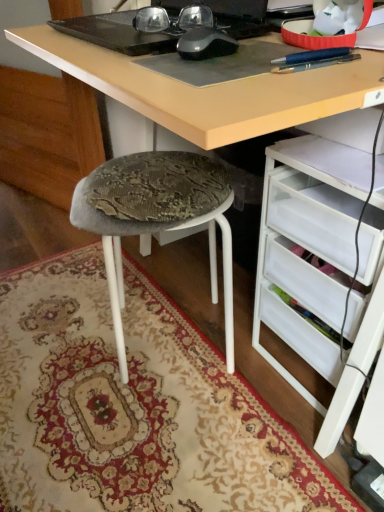
Question: Can you confirm if white plastic drawers at lower right is bigger than carpeted rug at lower left?

Choices:
 (A) no
 (B) yes

Answer: (B)

Question: From a real-world perspective, is white plastic drawers at lower right positioned over carpeted rug at lower left based on gravity?

Choices:
 (A) yes
 (B) no

Answer: (A)

Question: Is white plastic drawers at lower right beside carpeted rug at lower left?

Choices:
 (A) yes
 (B) no

Answer: (B)

Question: Is white plastic drawers at lower right closer to the viewer compared to carpeted rug at lower left?

Choices:
 (A) no
 (B) yes

Answer: (A)

Question: Does white plastic drawers at lower right have a lesser height compared to carpeted rug at lower left?

Choices:
 (A) yes
 (B) no

Answer: (B)

Question: From a real-world perspective, is white plastic drawers at lower right located beneath carpeted rug at lower left?

Choices:
 (A) yes
 (B) no

Answer: (B)

Question: Considering the relative positions of white plastic drawers at lower right and textured fabric stool at lower left in the image provided, is white plastic drawers at lower right to the right of textured fabric stool at lower left from the viewer's perspective?

Choices:
 (A) no
 (B) yes

Answer: (B)

Question: Is white plastic drawers at lower right positioned behind textured fabric stool at lower left?

Choices:
 (A) no
 (B) yes

Answer: (A)

Question: Can we say white plastic drawers at lower right lies outside textured fabric stool at lower left?

Choices:
 (A) yes
 (B) no

Answer: (A)

Question: Considering the relative sizes of white plastic drawers at lower right and textured fabric stool at lower left in the image provided, is white plastic drawers at lower right wider than textured fabric stool at lower left?

Choices:
 (A) no
 (B) yes

Answer: (A)

Question: Does white plastic drawers at lower right touch textured fabric stool at lower left?

Choices:
 (A) no
 (B) yes

Answer: (A)

Question: Considering the relative sizes of white plastic drawers at lower right and textured fabric stool at lower left in the image provided, is white plastic drawers at lower right smaller than textured fabric stool at lower left?

Choices:
 (A) yes
 (B) no

Answer: (A)

Question: Does matte black glasses at upper center lie behind textured fabric stool at lower left?

Choices:
 (A) no
 (B) yes

Answer: (A)